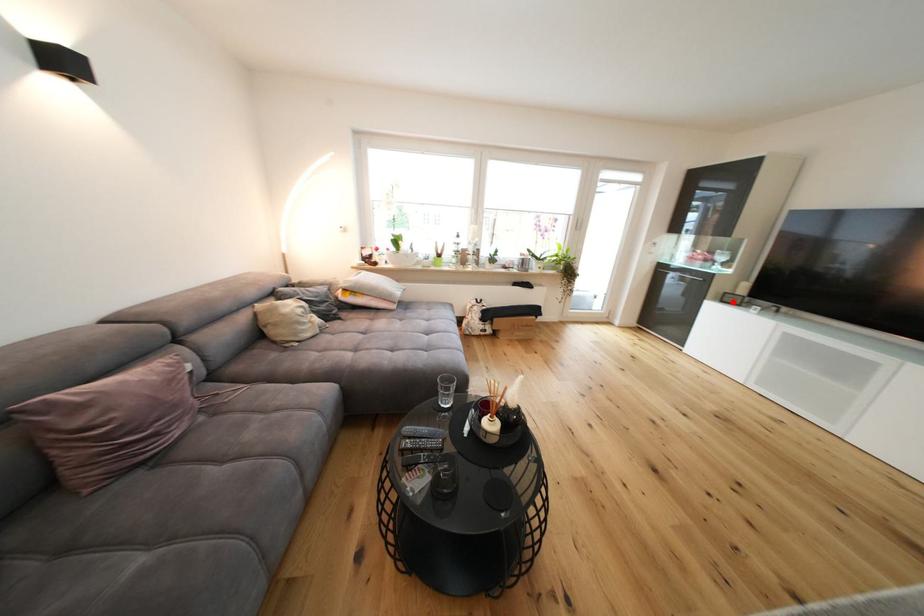
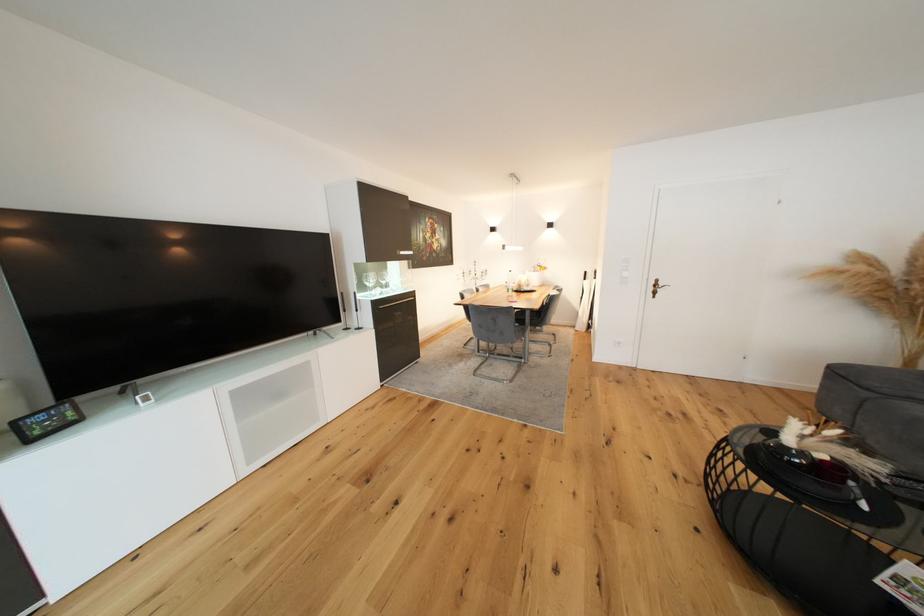
Question: I am providing you with two images of the same scene from different viewpoints. A red point is marked on the first image. Is the red point's position out of view in image 2?

Choices:
 (A) Yes
 (B) No

Answer: (B)